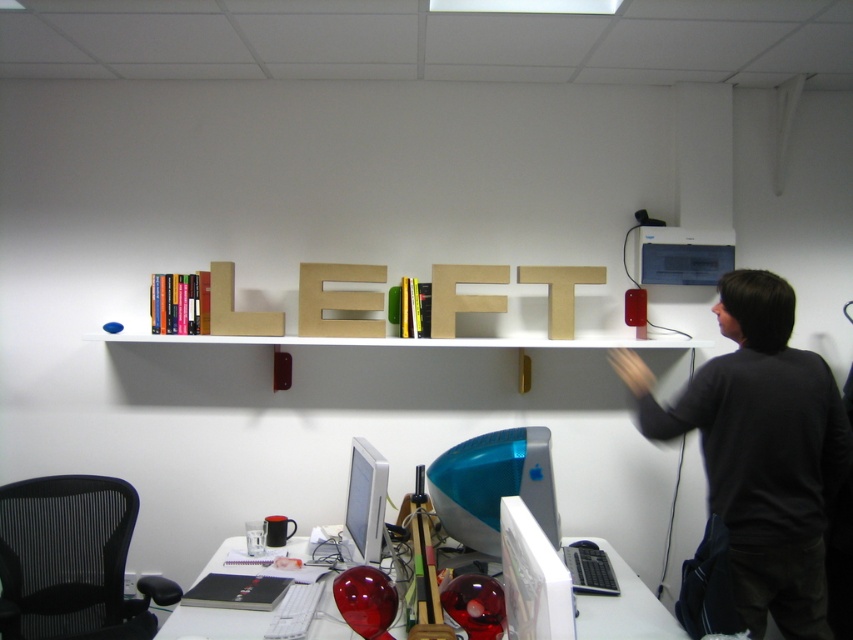
Which of these two, dark gray sweater at upper right or black mesh swivel chair at left, stands taller?

With more height is dark gray sweater at upper right.

Looking at this image, who is positioned more to the left, dark gray sweater at upper right or black mesh swivel chair at left?

Positioned to the left is black mesh swivel chair at left.

This screenshot has width=853, height=640. What do you see at coordinates (761, 451) in the screenshot?
I see `dark gray sweater at upper right` at bounding box center [761, 451].

You are a GUI agent. You are given a task and a screenshot of the screen. Output one action in this format:
    pyautogui.click(x=<x>, y=<y>)
    Task: Click on the dark gray sweater at upper right
    This screenshot has width=853, height=640.
    Given the screenshot: What is the action you would take?
    pyautogui.click(x=761, y=451)

This screenshot has height=640, width=853. What do you see at coordinates (761, 451) in the screenshot?
I see `dark gray sweater at upper right` at bounding box center [761, 451].

Can you confirm if dark gray sweater at upper right is positioned below white glossy computer desk at lower center?

No.

Who is more distant from viewer, (750,371) or (633,627)?

The point (750,371) is behind.

Image resolution: width=853 pixels, height=640 pixels. Identify the location of dark gray sweater at upper right. (761, 451).

Is point (1, 508) less distant than point (595, 540)?

Yes, it is.

Between point (137, 496) and point (161, 625), which one is positioned behind?

The point (161, 625) is behind.

Describe the element at coordinates (73, 561) in the screenshot. The height and width of the screenshot is (640, 853). I see `black mesh swivel chair at left` at that location.

Find the location of a particular element. The height and width of the screenshot is (640, 853). black mesh swivel chair at left is located at coordinates (73, 561).